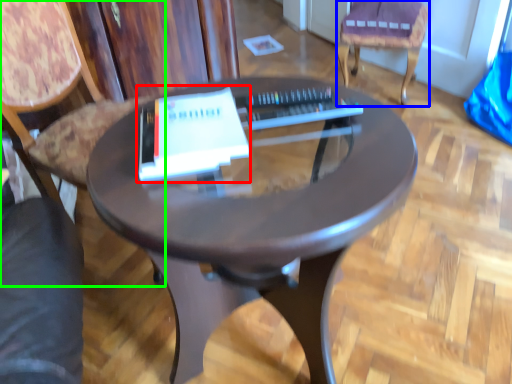
Question: Based on their relative distances, which object is nearer to paperback book (highlighted by a red box)? Choose from chair (highlighted by a blue box) and chair (highlighted by a green box).

Choices:
 (A) chair
 (B) chair

Answer: (B)